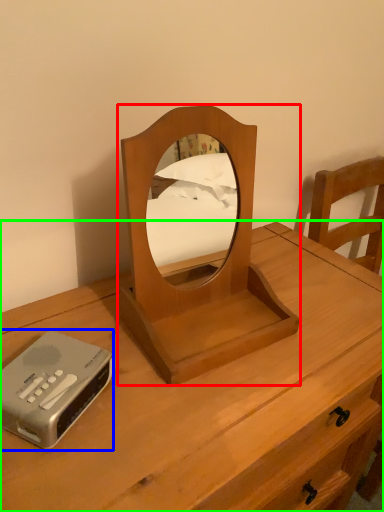
Question: Based on their relative distances, which object is nearer to mirror (highlighted by a red box)? Choose from cassette (highlighted by a blue box) and nightstand (highlighted by a green box).

Choices:
 (A) cassette
 (B) nightstand

Answer: (B)